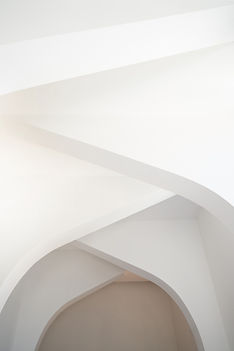
Locate an element on the screen. The image size is (234, 351). third lowest shelf is located at coordinates (80, 203).